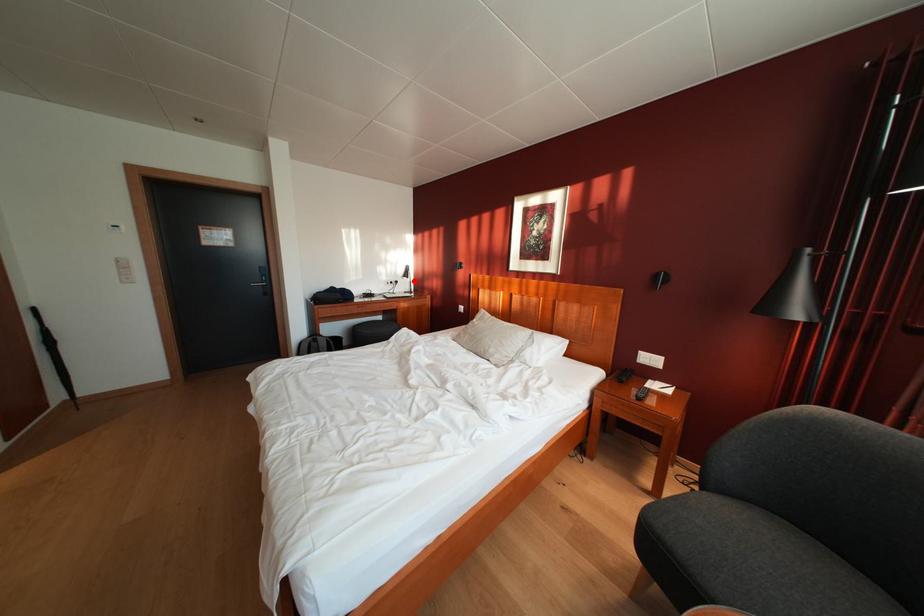
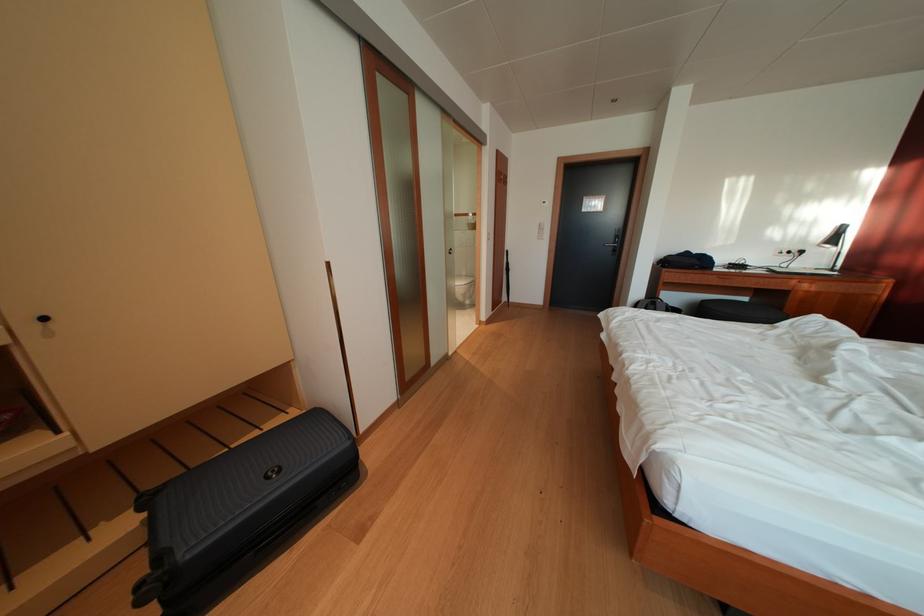
Question: I am providing you with two images of the same scene from different viewpoints. A red point is shown in image1. For the corresponding object point in image2, is it positioned nearer or farther from the camera?

Choices:
 (A) Nearer
 (B) Farther

Answer: (B)